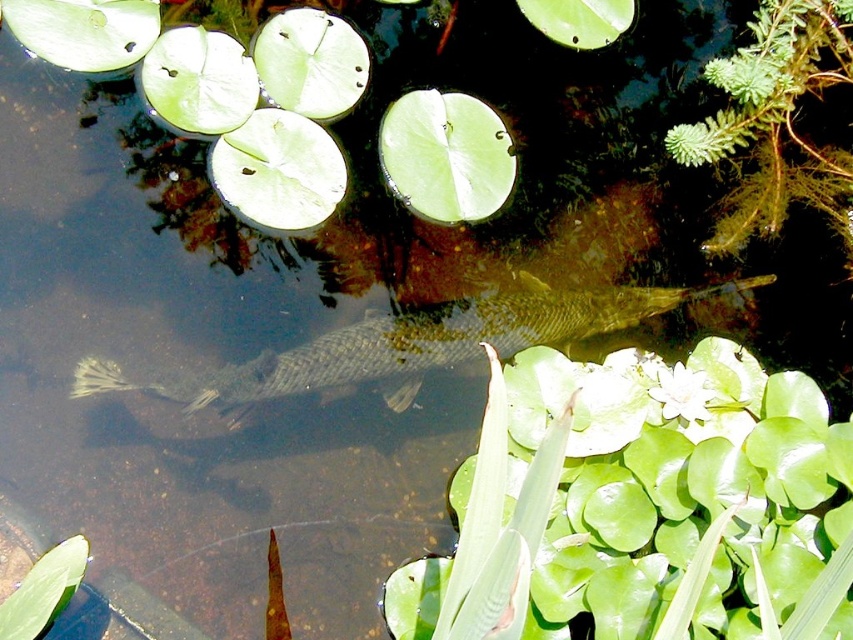
You are a frog sitting on the green glossy leaf at center and want to jump to the shiny silver fish at center. Which direction should you jump to reach it?

The green glossy leaf at center is to the right of the shiny silver fish at center, so you should jump to the left to reach it.

You are a frog sitting at the origin point of the image coordinate system. You want to jump to the green glossy leaf at center. In which direction should you jump?

The green glossy leaf at center is located at point (639,509), so you should jump towards the lower right direction from your current position at the origin.

You are a researcher studying aquatic life and need to determine the position of the shiny silver fish at center relative to the lily pads. Based on the coordinates provided, can you confirm if the fish is positioned under the overlapping area of two lily pads?

The shiny silver fish at center is located at coordinates point (410, 344). Without specific information about the lily pads overlap areas, it is impossible to confirm if the fish is under overlapping lily pads.